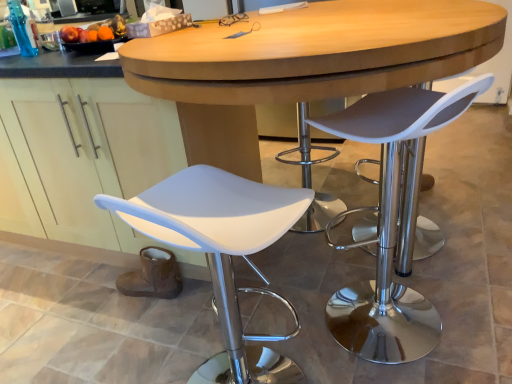
Identify the location of free space to the back side of matte gray seat at right, placed as the second chair when sorted from left to right. Image resolution: width=512 pixels, height=384 pixels. (339, 265).